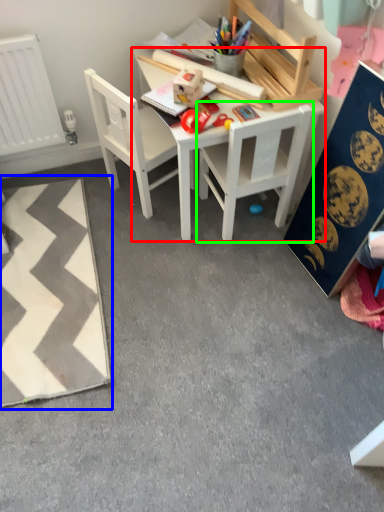
Question: Which object is positioned farthest from table (highlighted by a red box)? Select from mat (highlighted by a blue box) and chair (highlighted by a green box).

Choices:
 (A) mat
 (B) chair

Answer: (A)